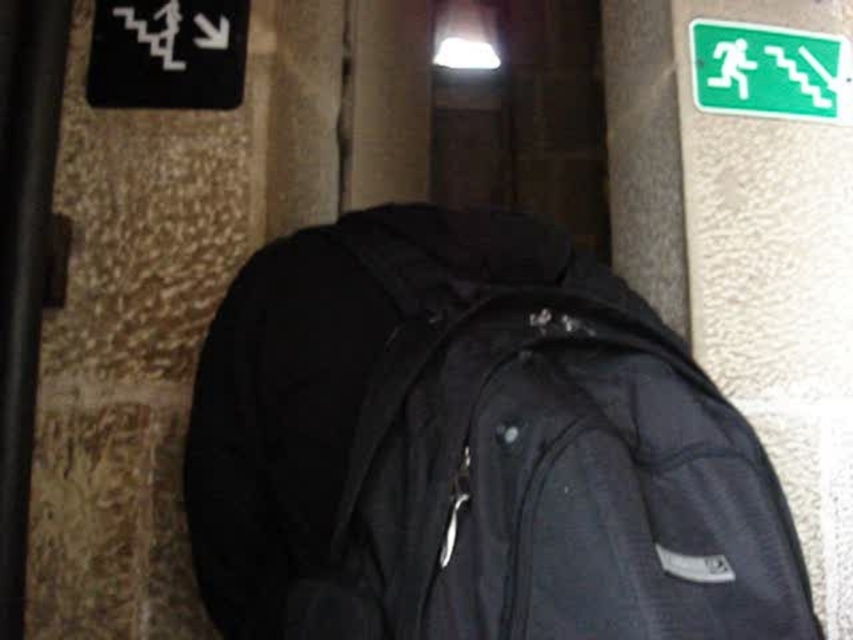
You are standing in a hallway and see the black fabric backpack at center and the green plastic emergency exit sign at upper right. Which object is closer to the ceiling?

The green plastic emergency exit sign at upper right is closer to the ceiling because it is positioned above the black fabric backpack at center.

You are standing in a hallway with a black fabric backpack at center. You need to place a small package on the wall directly behind the backpack. Where should you place it relative to the backpack?

The small package should be placed directly behind the black fabric backpack at center, aligned with its position at point 0.703 on the horizontal axis and 0.553 on the vertical axis.

You are standing in a hallway and see the black fabric backpack at center and the green plastic emergency exit sign at upper right. Which object is nearer to you?

The black fabric backpack at center is closer to the viewer than the green plastic emergency exit sign at upper right.